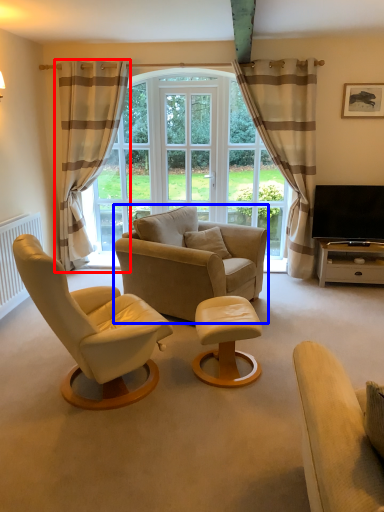
Question: Which object is closer to the camera taking this photo, curtain (highlighted by a red box) or chair (highlighted by a blue box)?

Choices:
 (A) curtain
 (B) chair

Answer: (B)